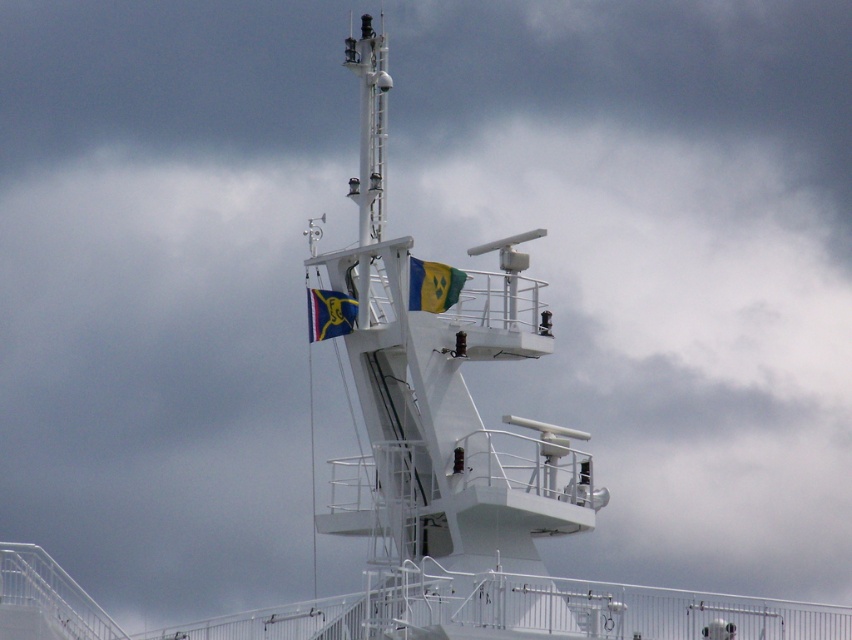
Question: Does yellow-green fabric flag at upper center have a larger size compared to blue fabric flag at upper center?

Choices:
 (A) yes
 (B) no

Answer: (B)

Question: Does yellow-green fabric flag at upper center appear on the right side of blue fabric flag at upper center?

Choices:
 (A) no
 (B) yes

Answer: (B)

Question: Which of the following is the closest to the observer?

Choices:
 (A) blue fabric flag at upper center
 (B) yellow-green fabric flag at upper center

Answer: (B)

Question: Which of the following is the closest to the observer?

Choices:
 (A) blue fabric flag at upper center
 (B) yellow-green fabric flag at upper center

Answer: (B)

Question: Is the position of yellow-green fabric flag at upper center less distant than that of blue fabric flag at upper center?

Choices:
 (A) no
 (B) yes

Answer: (B)